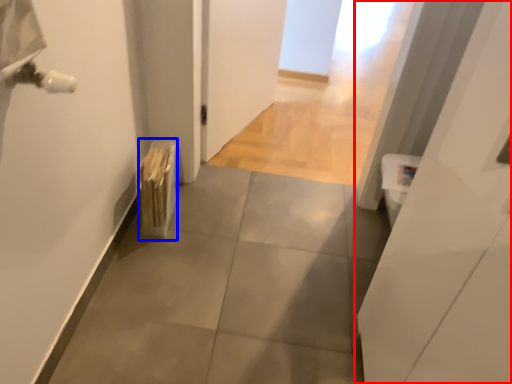
Question: Which object is further to the camera taking this photo, door (highlighted by a red box) or radiator (highlighted by a blue box)?

Choices:
 (A) door
 (B) radiator

Answer: (B)